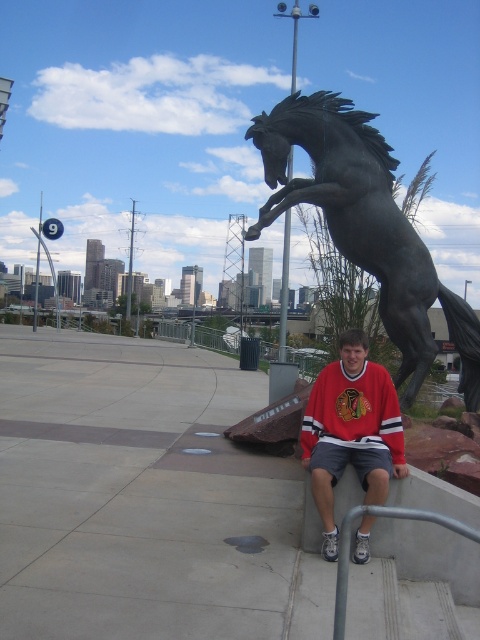
Question: Does red matte jersey at center have a lesser width compared to gray metallic rail at lower center?

Choices:
 (A) no
 (B) yes

Answer: (A)

Question: Which point is farther to the camera?

Choices:
 (A) red matte jersey at center
 (B) gray metallic rail at lower center
 (C) bronze horse at upper right

Answer: (C)

Question: Observing the image, what is the correct spatial positioning of bronze horse at upper right in reference to red matte jersey at center?

Choices:
 (A) left
 (B) right

Answer: (B)

Question: Which point is farther to the camera?

Choices:
 (A) (464, 308)
 (B) (384, 376)
 (C) (474, 540)

Answer: (A)

Question: Which point appears closest to the camera in this image?

Choices:
 (A) (334, 403)
 (B) (351, 524)

Answer: (B)

Question: In this image, where is bronze horse at upper right located relative to red matte jersey at center?

Choices:
 (A) above
 (B) below

Answer: (A)